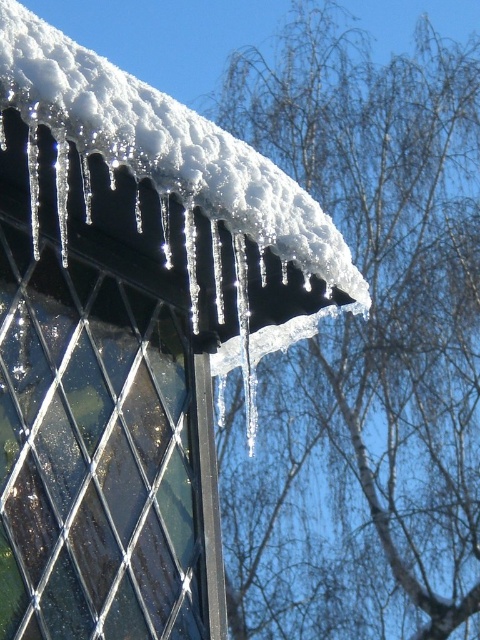
Question: Which point appears closest to the camera in this image?

Choices:
 (A) (137, 228)
 (B) (305, 392)

Answer: (A)

Question: Can you confirm if white snow at upper center is positioned above clear ice icicles at upper left?

Choices:
 (A) yes
 (B) no

Answer: (B)

Question: Where is white snow at upper center located in relation to clear ice icicles at upper left in the image?

Choices:
 (A) below
 (B) above

Answer: (A)

Question: Which point is closer to the camera taking this photo?

Choices:
 (A) (212, 163)
 (B) (466, 627)

Answer: (A)

Question: Is the position of white snow at upper center more distant than that of clear ice icicles at upper left?

Choices:
 (A) no
 (B) yes

Answer: (B)